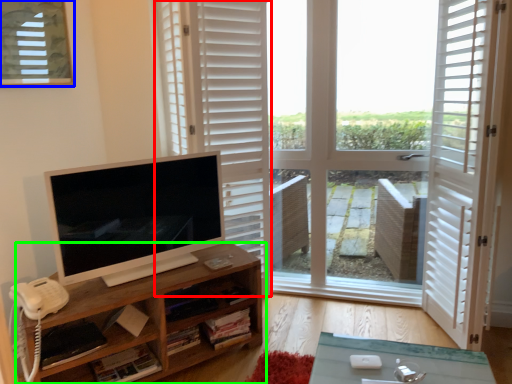
Question: Which is farther away from curtain (highlighted by a red box)? window (highlighted by a blue box) or shelf (highlighted by a green box)?

Choices:
 (A) window
 (B) shelf

Answer: (B)